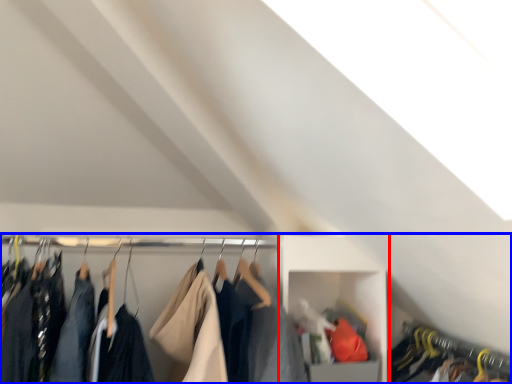
Question: Which of the following is the farthest to the observer, cabinet (highlighted by a red box) or closet (highlighted by a blue box)?

Choices:
 (A) cabinet
 (B) closet

Answer: (A)